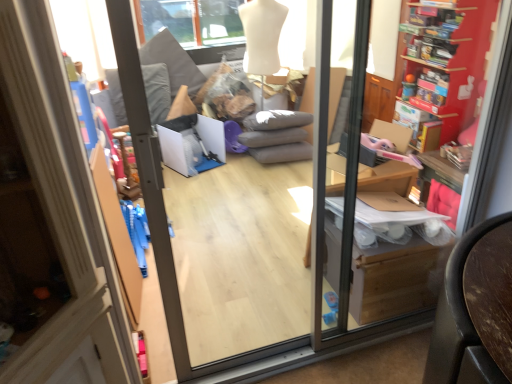
Question: Is wooden bookshelf at right outside of matte cardboard box at right?

Choices:
 (A) no
 (B) yes

Answer: (B)

Question: Can you confirm if wooden bookshelf at right is wider than matte cardboard box at right?

Choices:
 (A) yes
 (B) no

Answer: (B)

Question: Is wooden bookshelf at right positioned with its back to matte cardboard box at right?

Choices:
 (A) no
 (B) yes

Answer: (A)

Question: From the image's perspective, is wooden bookshelf at right located beneath matte cardboard box at right?

Choices:
 (A) no
 (B) yes

Answer: (A)

Question: Considering the relative positions of wooden bookshelf at right and matte cardboard box at right in the image provided, is wooden bookshelf at right to the right of matte cardboard box at right from the viewer's perspective?

Choices:
 (A) no
 (B) yes

Answer: (B)

Question: Does wooden bookshelf at right have a lesser height compared to matte cardboard box at right?

Choices:
 (A) no
 (B) yes

Answer: (A)

Question: From the image's perspective, is matte cardboard box at right below transparent glass screen door at center?

Choices:
 (A) yes
 (B) no

Answer: (A)

Question: Does matte cardboard box at right have a greater height compared to transparent glass screen door at center?

Choices:
 (A) yes
 (B) no

Answer: (B)

Question: From a real-world perspective, is matte cardboard box at right below transparent glass screen door at center?

Choices:
 (A) yes
 (B) no

Answer: (A)

Question: Is matte cardboard box at right far away from transparent glass screen door at center?

Choices:
 (A) no
 (B) yes

Answer: (A)

Question: Is matte cardboard box at right oriented towards transparent glass screen door at center?

Choices:
 (A) yes
 (B) no

Answer: (B)

Question: Is transparent glass screen door at center at the back of matte cardboard box at right?

Choices:
 (A) yes
 (B) no

Answer: (B)

Question: Can you confirm if transparent glass screen door at center is positioned to the right of matte cardboard box at right?

Choices:
 (A) no
 (B) yes

Answer: (A)